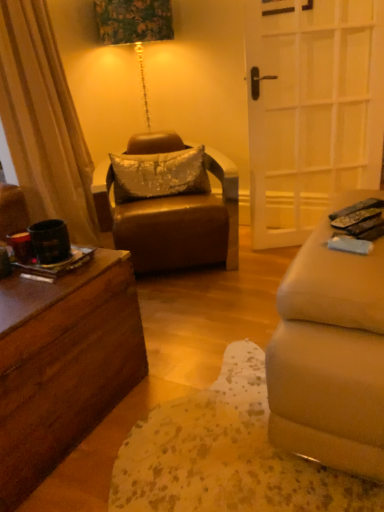
Question: Is white glass door at right bigger than leather at center?

Choices:
 (A) yes
 (B) no

Answer: (B)

Question: Is white glass door at right looking in the opposite direction of leather at center?

Choices:
 (A) yes
 (B) no

Answer: (B)

Question: Considering the relative sizes of white glass door at right and leather at center in the image provided, is white glass door at right thinner than leather at center?

Choices:
 (A) no
 (B) yes

Answer: (B)

Question: Would you say white glass door at right is outside leather at center?

Choices:
 (A) no
 (B) yes

Answer: (B)

Question: Does white glass door at right contain leather at center?

Choices:
 (A) yes
 (B) no

Answer: (B)

Question: From their relative heights in the image, would you say silver sequined pillow at center is taller or shorter than leather at center?

Choices:
 (A) tall
 (B) short

Answer: (B)

Question: From the image's perspective, is silver sequined pillow at center above or below leather at center?

Choices:
 (A) above
 (B) below

Answer: (A)

Question: From a real-world perspective, is silver sequined pillow at center positioned above or below leather at center?

Choices:
 (A) above
 (B) below

Answer: (A)

Question: In the image, is silver sequined pillow at center positioned in front of or behind leather at center?

Choices:
 (A) behind
 (B) front

Answer: (A)

Question: Is point (349, 210) positioned closer to the camera than point (216, 214)?

Choices:
 (A) closer
 (B) farther

Answer: (A)

Question: From their relative heights in the image, would you say black plastic remote control at lower right is taller or shorter than leather at center?

Choices:
 (A) tall
 (B) short

Answer: (B)

Question: In terms of width, does black plastic remote control at lower right look wider or thinner when compared to leather at center?

Choices:
 (A) thin
 (B) wide

Answer: (A)

Question: From the image's perspective, is black plastic remote control at lower right positioned above or below leather at center?

Choices:
 (A) below
 (B) above

Answer: (A)

Question: Is leather at center in front of or behind white glass door at right in the image?

Choices:
 (A) behind
 (B) front

Answer: (B)

Question: Considering the positions of leather at center and white glass door at right in the image, is leather at center wider or thinner than white glass door at right?

Choices:
 (A) thin
 (B) wide

Answer: (B)